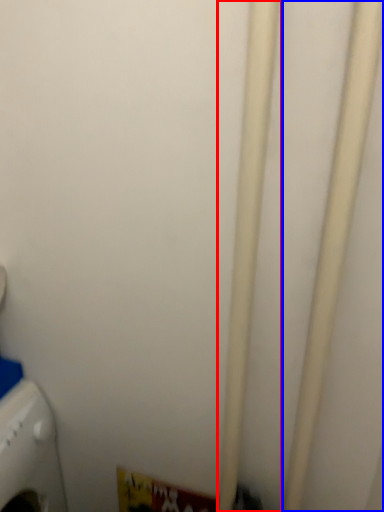
Question: Among these objects, which one is nearest to the camera, pipe (highlighted by a red box) or pipe (highlighted by a blue box)?

Choices:
 (A) pipe
 (B) pipe

Answer: (B)